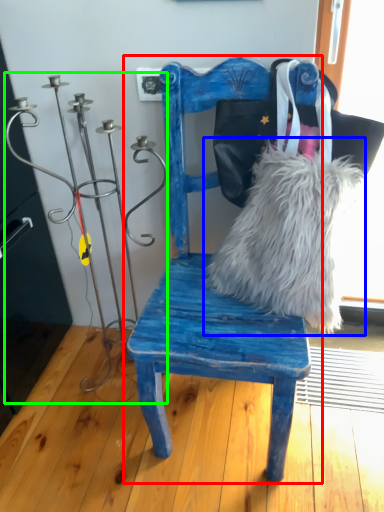
Question: Estimate the real-world distances between objects in this image. Which object is farther from chair (highlighted by a red box), fur (highlighted by a blue box) or candle holder (highlighted by a green box)?

Choices:
 (A) fur
 (B) candle holder

Answer: (B)